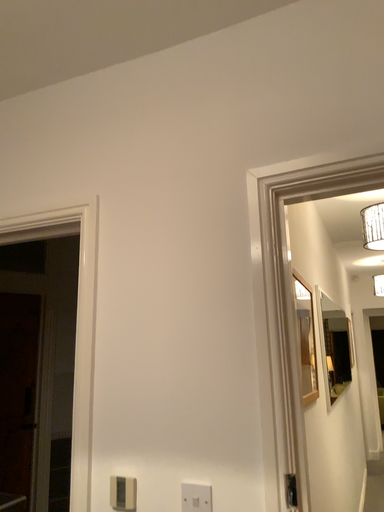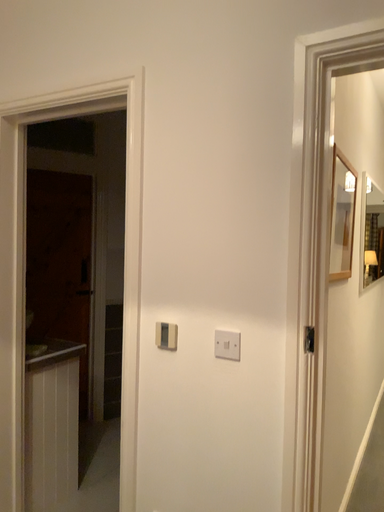
Question: Which way did the camera rotate in the video?

Choices:
 (A) rotated upward
 (B) rotated downward

Answer: (B)